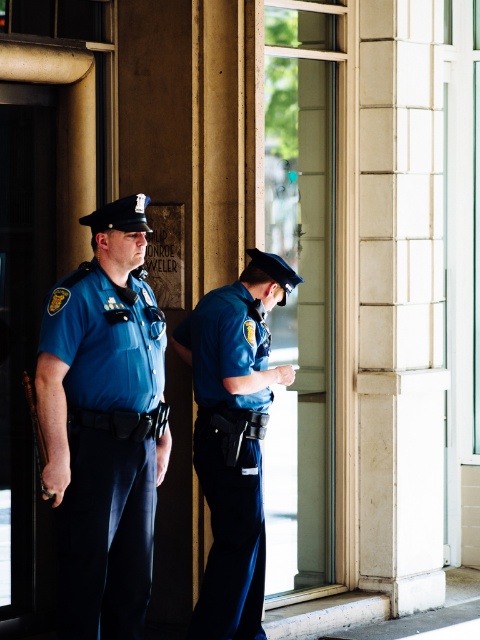
Question: Is white marble pillar at right behind blue uniform at right?

Choices:
 (A) yes
 (B) no

Answer: (A)

Question: Does matte blue uniform at left appear under blue uniform at right?

Choices:
 (A) no
 (B) yes

Answer: (A)

Question: Which object is farther from the camera taking this photo?

Choices:
 (A) matte blue uniform at left
 (B) white marble pillar at right

Answer: (B)

Question: Is white marble pillar at right smaller than blue uniform at right?

Choices:
 (A) yes
 (B) no

Answer: (B)

Question: Which is nearer to the matte blue uniform at left?

Choices:
 (A) white marble pillar at right
 (B) blue uniform at right

Answer: (B)

Question: Which point is farther to the camera?

Choices:
 (A) (206, 326)
 (B) (106, 289)

Answer: (A)